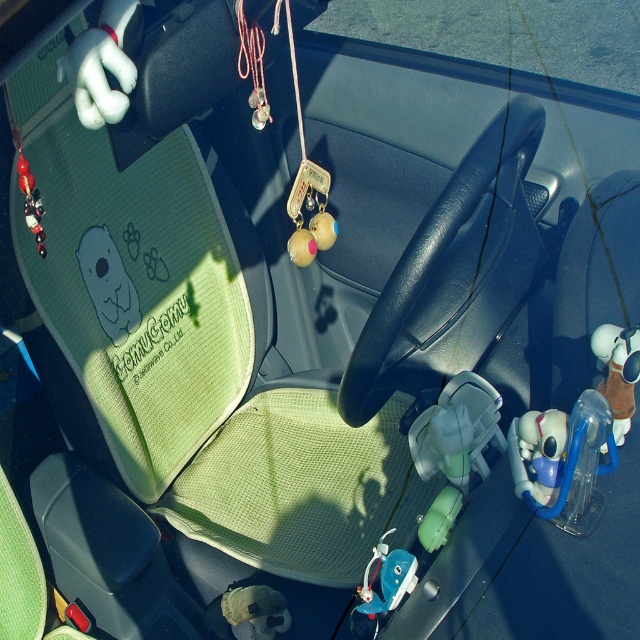
Question: Is white plush toy at right to the left of blue plastic toy at center from the viewer's perspective?

Choices:
 (A) yes
 (B) no

Answer: (B)

Question: Is the position of white plush toy at right less distant than that of blue plastic toy at center?

Choices:
 (A) yes
 (B) no

Answer: (A)

Question: Is white plush toy at right above blue plastic toy at center?

Choices:
 (A) no
 (B) yes

Answer: (B)

Question: Among these points, which one is nearest to the camera?

Choices:
 (A) (625, 342)
 (B) (564, 442)
 (C) (392, 593)

Answer: (B)

Question: Which is nearer to the blue plastic toy at center?

Choices:
 (A) white plush toy at right
 (B) translucent plastic toy at center

Answer: (B)

Question: Estimate the real-world distances between objects in this image. Which object is closer to the blue plastic toy at center?

Choices:
 (A) translucent plastic toy at center
 (B) white plush toy at right

Answer: (A)